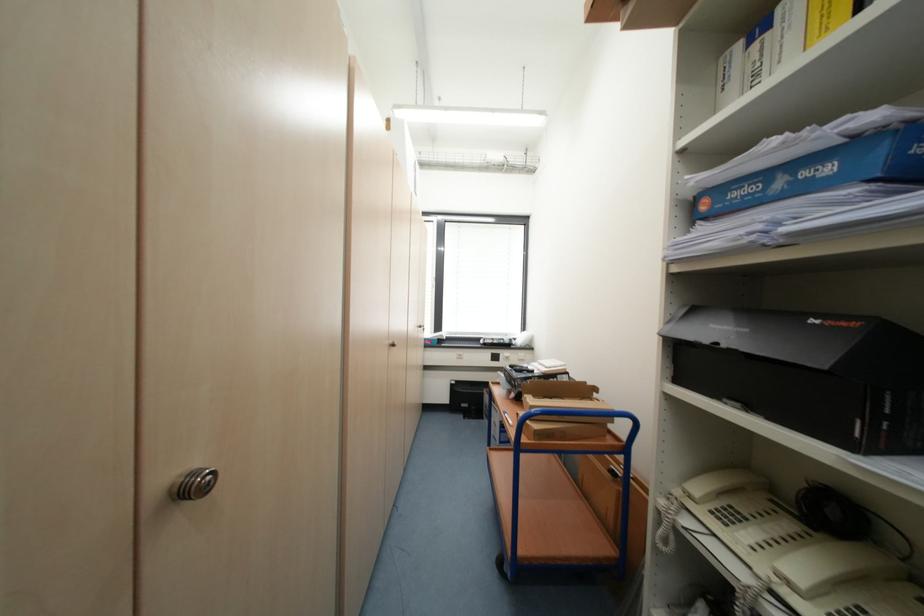
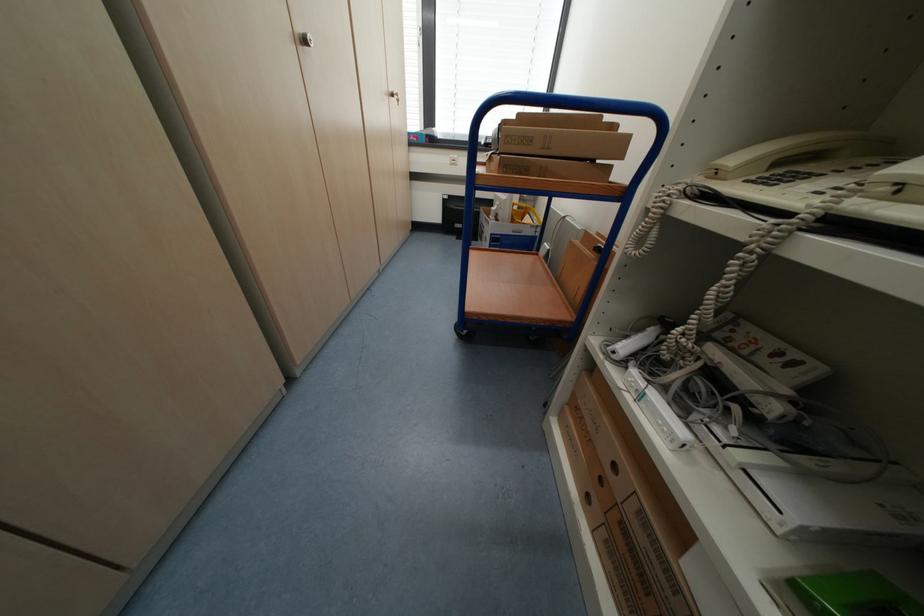
Find the pixel in the second image that matches the point at 399,346 in the first image.

(311, 42)